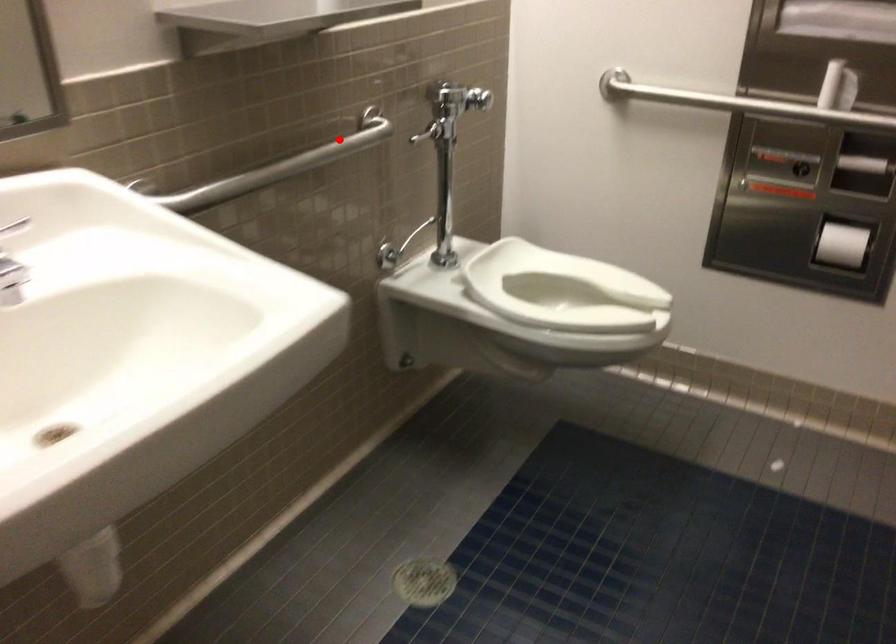
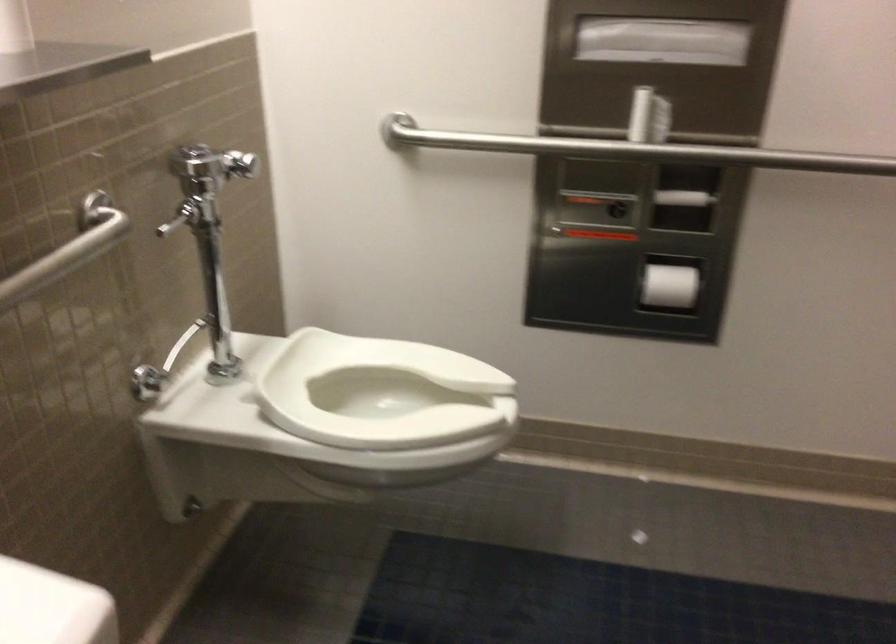
Locate, in the second image, the point that corresponds to the highlighted location in the first image.

(67, 250)